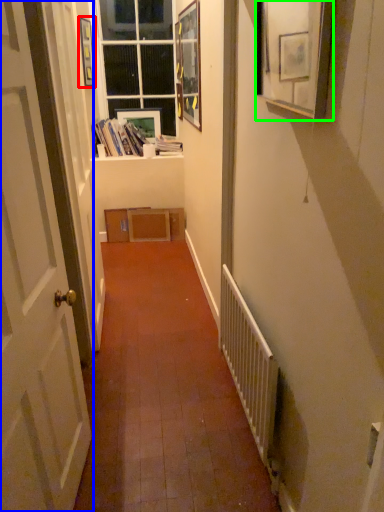
Question: Which object is positioned closest to picture frame (highlighted by a red box)? Select from door (highlighted by a blue box) and picture frame (highlighted by a green box).

Choices:
 (A) door
 (B) picture frame

Answer: (A)